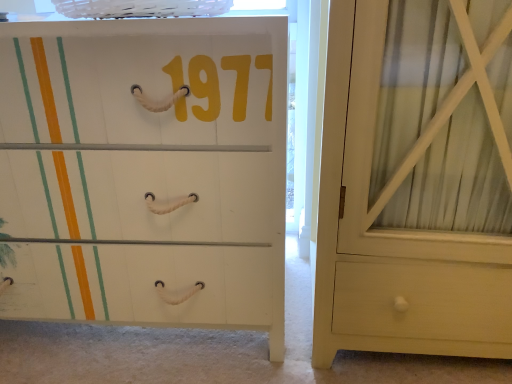
What do you see at coordinates (145, 171) in the screenshot? I see `white painted wood chest of drawers at left` at bounding box center [145, 171].

This screenshot has width=512, height=384. I want to click on white painted wood chest of drawers at left, so [x=145, y=171].

This screenshot has width=512, height=384. Identify the location of white painted wood chest of drawers at left. (145, 171).